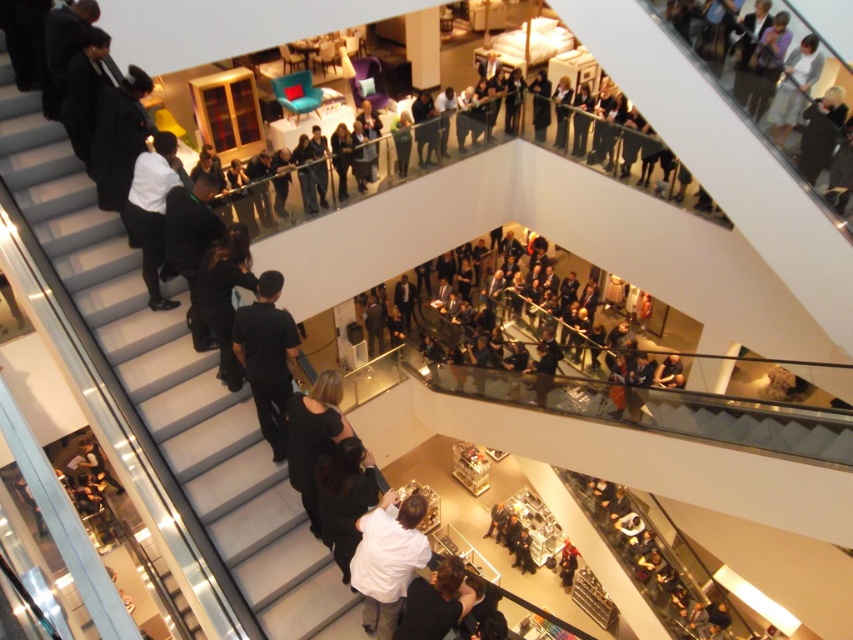
You are standing at the entrance of the mall and want to reach the information desk located at the center of the atrium. The white glossy stairs at left are in your way. Can you walk around them to reach the desk?

The white glossy stairs at left are positioned at point (173, 387), so you can walk around them to reach the information desk at the center of the atrium.

You are a photographer standing at the entrance of the mall and want to capture a clear shot of the white glossy stairs at left. Given that your camera has a minimum focusing distance of 15 feet, can you take the photo without moving closer?

The white glossy stairs at left are 16.40 feet away from the camera. Since the minimum focusing distance is 15 feet, the camera can focus on the stairs as they are beyond the minimum required distance.